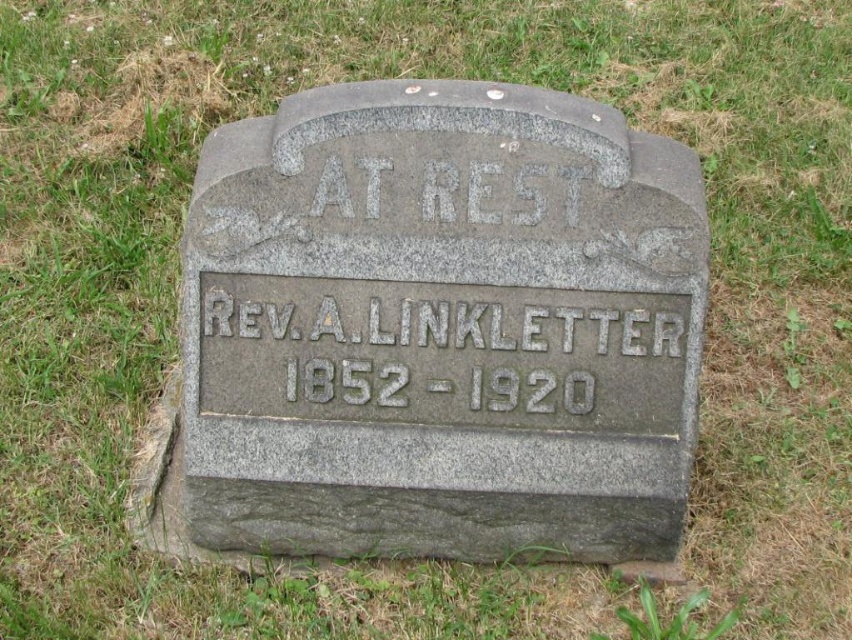
You are standing in a cemetery and see the gray stone gravestone at center and the gray granite inscription at center. Which one is located to the left?

The gray stone gravestone at center is positioned on the left side of the gray granite inscription at center.